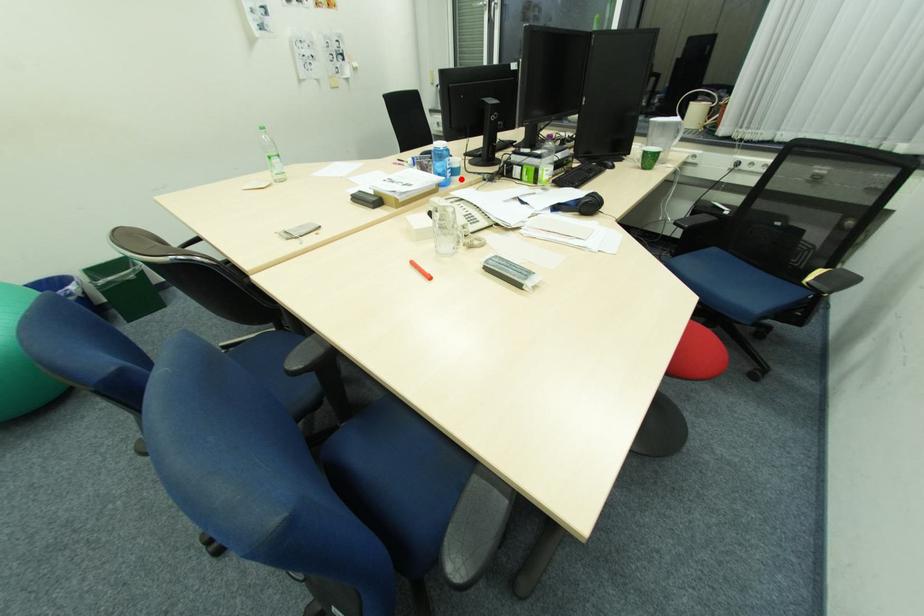
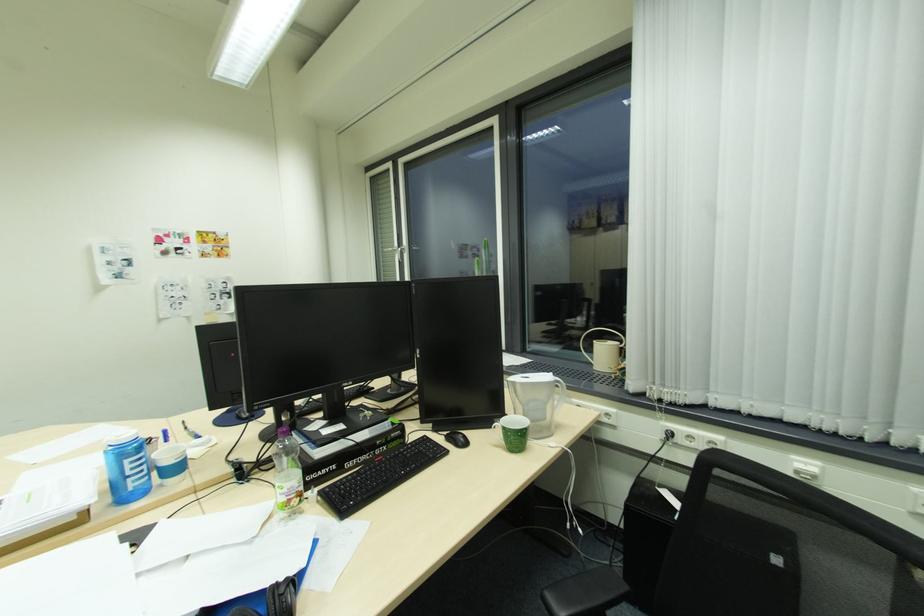
Locate, in the second image, the point that corresponds to the highlighted location in the first image.

(176, 482)